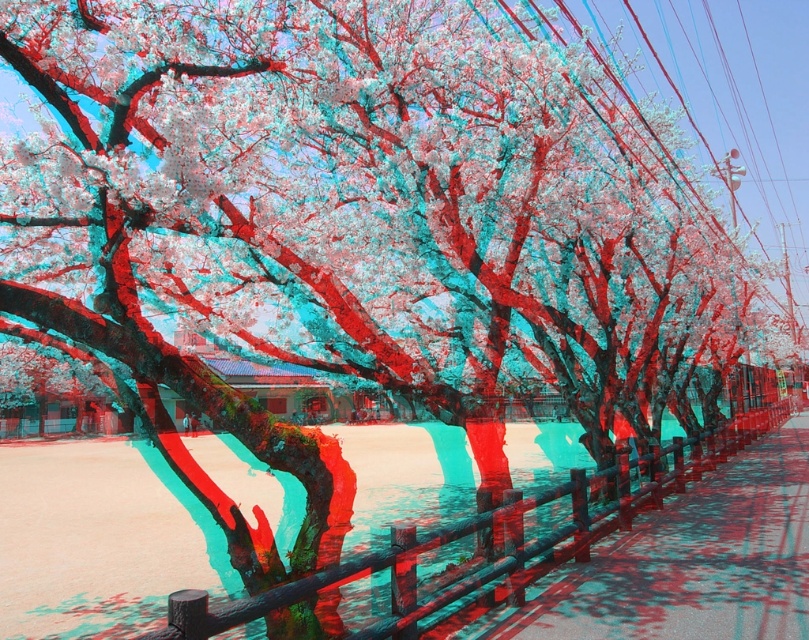
Is point (721, 541) farther from viewer compared to point (617, 470)?

No, (721, 541) is closer to viewer.

Is smooth concrete pavement at center to the left of wooden fence at center from the viewer's perspective?

In fact, smooth concrete pavement at center is to the right of wooden fence at center.

Between point (596, 561) and point (528, 528), which one is positioned in front?

Point (596, 561)

This screenshot has height=640, width=809. I want to click on smooth concrete pavement at center, so click(693, 561).